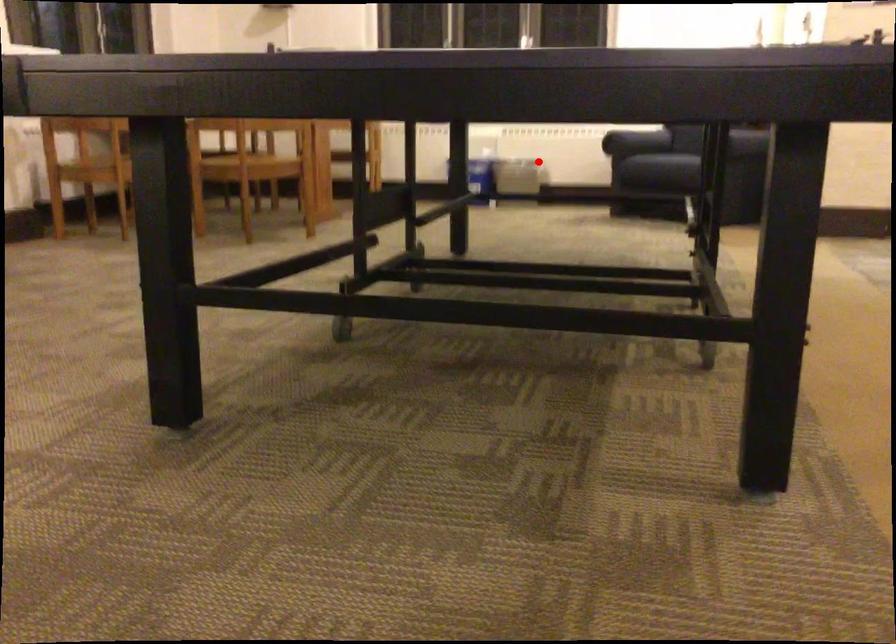
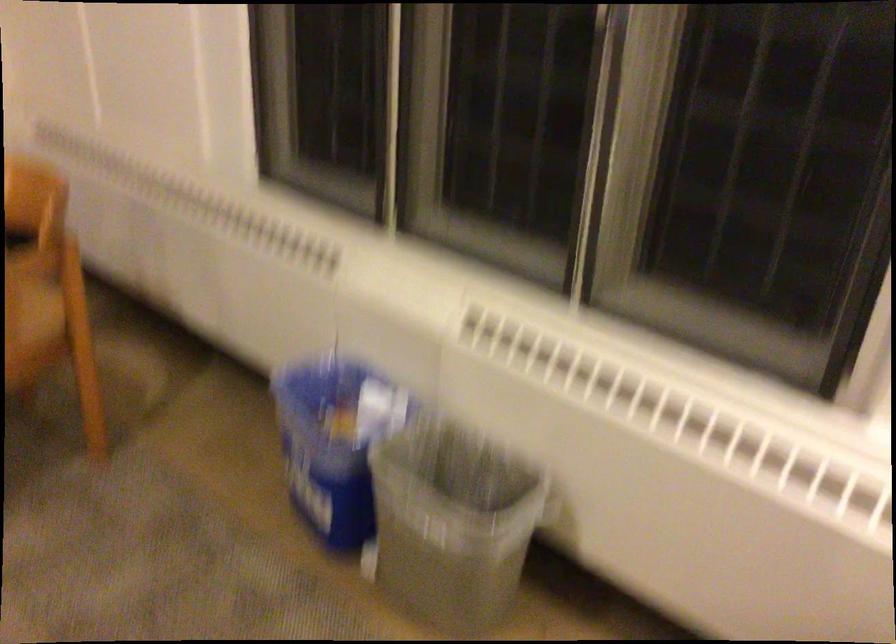
Find the pixel in the second image that matches the highlighted location in the first image.

(451, 524)